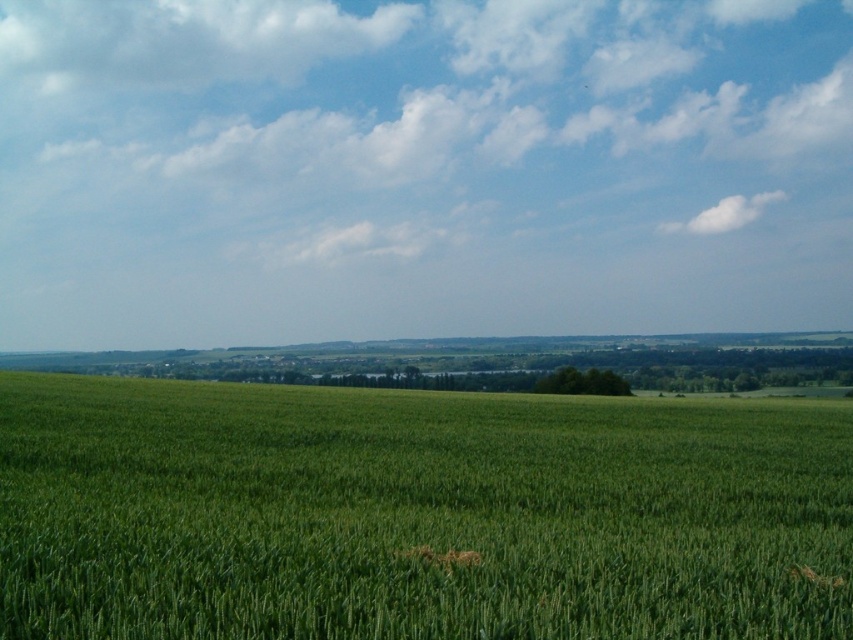
Who is higher up, blue sky at upper center or green grassy field at center?

blue sky at upper center is above.

Can you confirm if blue sky at upper center is thinner than green grassy field at center?

In fact, blue sky at upper center might be wider than green grassy field at center.

Between point (465, 96) and point (206, 532), which one is positioned in front?

Positioned in front is point (206, 532).

Locate an element on the screen. Image resolution: width=853 pixels, height=640 pixels. blue sky at upper center is located at coordinates [416, 168].

From the picture: Is the position of green grassy field at center less distant than that of white fluffy cloud at upper right?

Yes, it is in front of white fluffy cloud at upper right.

Between point (730, 490) and point (663, 232), which one is positioned behind?

Point (663, 232)

Does point (723, 634) come farther from viewer compared to point (775, 202)?

No, it is not.

Find the location of a particular element. green grassy field at center is located at coordinates (416, 513).

Between green grassy field at center and white fluffy cloud at upper center, which one appears on the right side from the viewer's perspective?

green grassy field at center

Is green grassy field at center to the right of white fluffy cloud at upper center from the viewer's perspective?

Yes, green grassy field at center is to the right of white fluffy cloud at upper center.

This screenshot has height=640, width=853. In order to click on green grassy field at center in this screenshot , I will do `click(416, 513)`.

In order to click on green grassy field at center in this screenshot , I will do `click(416, 513)`.